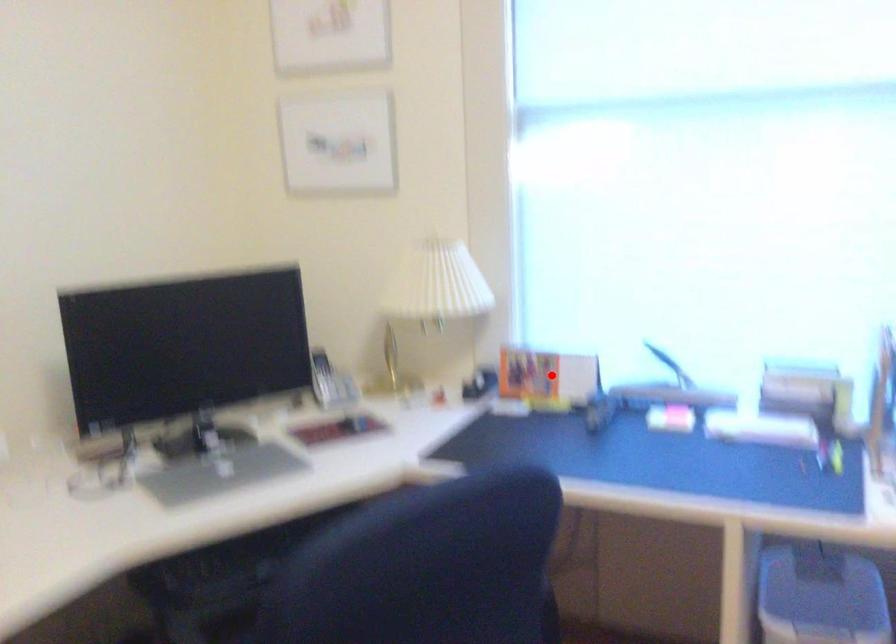
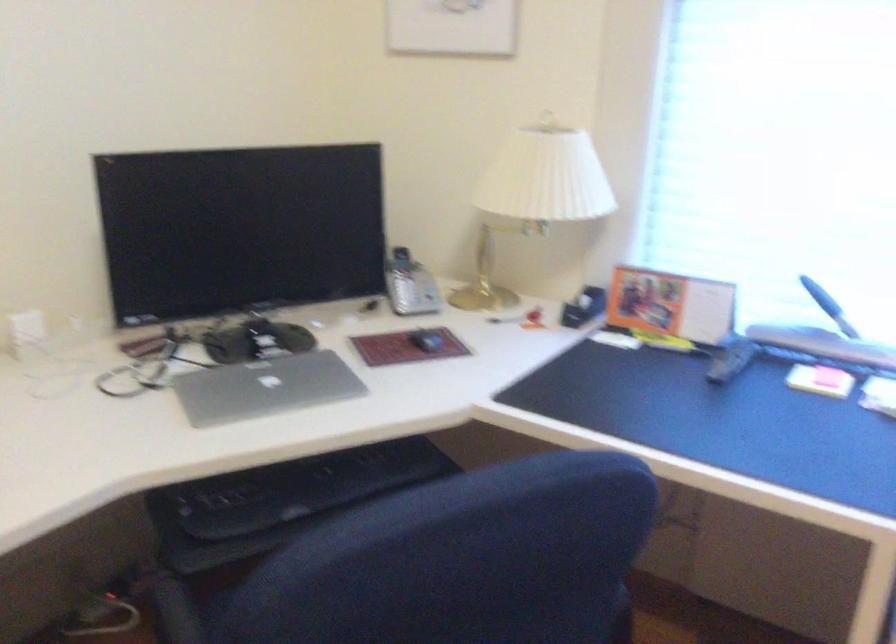
Question: I am providing you with two images of the same scene from different viewpoints. Given a red point in image1, look at the same physical point in image2. Is it:

Choices:
 (A) Closer to the viewpoint
 (B) Farther from the viewpoint

Answer: (A)